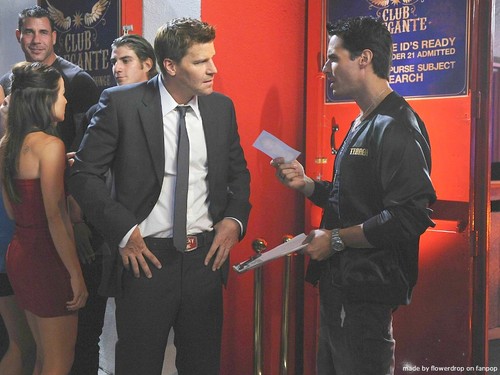
This screenshot has height=375, width=500. Identify the location of red doors. (263, 60), (457, 130), (441, 265).